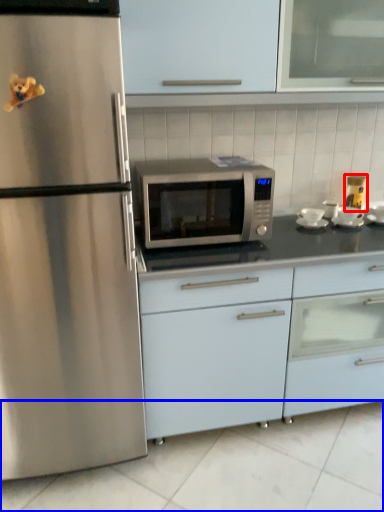
Question: Which object is further to the camera taking this photo, appliance (highlighted by a red box) or tile (highlighted by a blue box)?

Choices:
 (A) appliance
 (B) tile

Answer: (A)